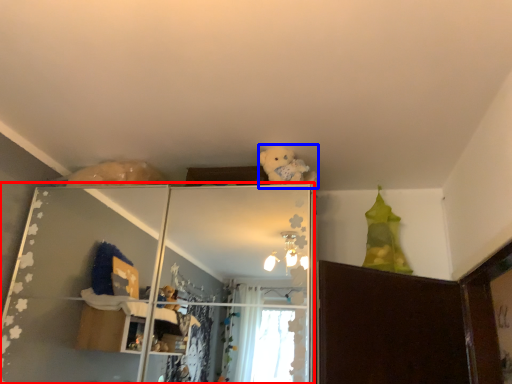
Question: Which object appears farthest to the camera in this image, shelf (highlighted by a red box) or teddy (highlighted by a blue box)?

Choices:
 (A) shelf
 (B) teddy

Answer: (B)